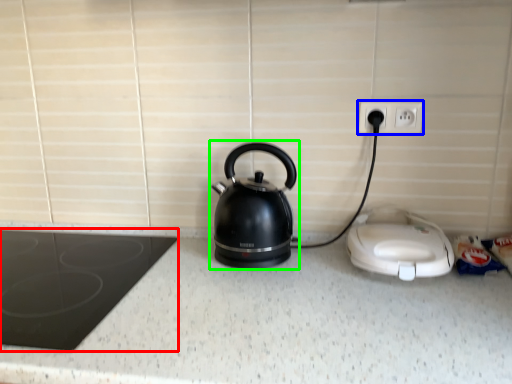
Question: Which is farther away from home appliance (highlighted by a red box)? electric outlet (highlighted by a blue box) or kitchen appliance (highlighted by a green box)?

Choices:
 (A) electric outlet
 (B) kitchen appliance

Answer: (A)